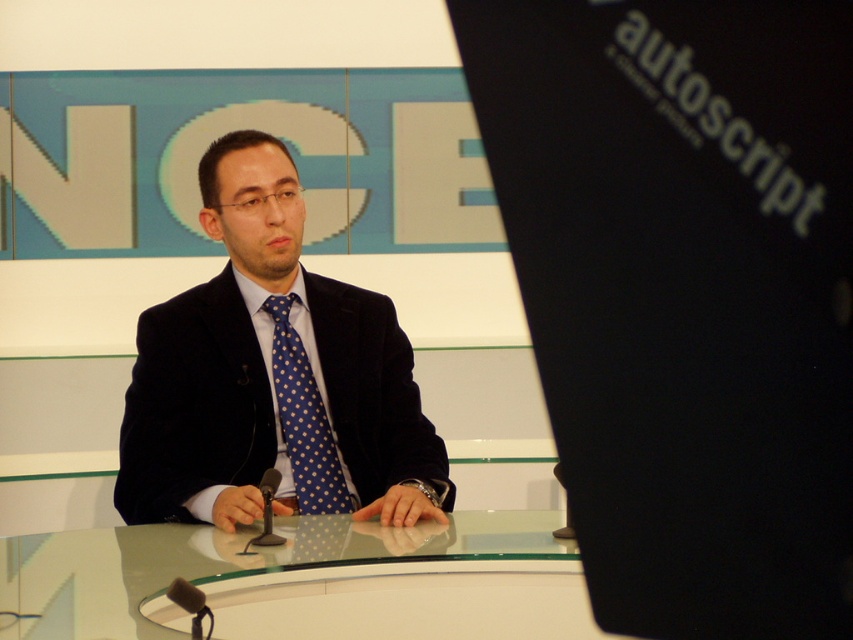
Question: Which object is closer to the camera taking this photo?

Choices:
 (A) transparent glass table at center
 (B) satin black suit at center

Answer: (A)

Question: Is satin black suit at center above transparent glass table at center?

Choices:
 (A) yes
 (B) no

Answer: (A)

Question: Does transparent glass table at center come in front of blue dotted fabric tie at center?

Choices:
 (A) yes
 (B) no

Answer: (A)

Question: Among these objects, which one is nearest to the camera?

Choices:
 (A) blue dotted fabric tie at center
 (B) transparent glass table at center

Answer: (B)

Question: Estimate the real-world distances between objects in this image. Which object is closer to the satin black suit at center?

Choices:
 (A) blue dotted fabric tie at center
 (B) transparent glass table at center

Answer: (A)

Question: Considering the relative positions of satin black suit at center and blue dotted fabric tie at center in the image provided, where is satin black suit at center located with respect to blue dotted fabric tie at center?

Choices:
 (A) left
 (B) right

Answer: (A)